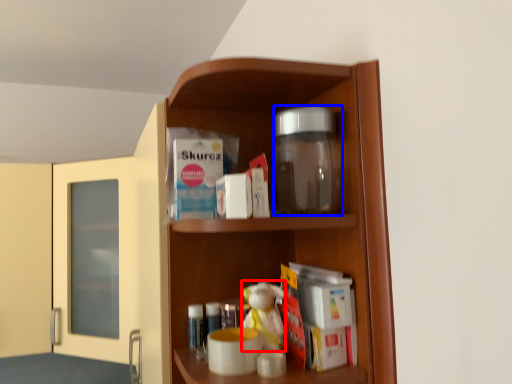
Question: Which object appears closest to the camera in this image, toy (highlighted by a red box) or glass jar (highlighted by a blue box)?

Choices:
 (A) toy
 (B) glass jar

Answer: (B)